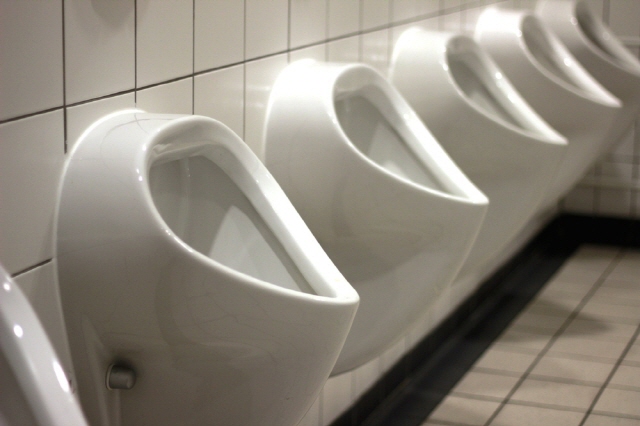
You are a GUI agent. You are given a task and a screenshot of the screen. Output one action in this format:
    pyautogui.click(x=<x>, y=<y>)
    Task: Click on the urinals
    Image resolution: width=640 pixels, height=426 pixels.
    Given the screenshot: What is the action you would take?
    pyautogui.click(x=22, y=373), pyautogui.click(x=179, y=299), pyautogui.click(x=356, y=181), pyautogui.click(x=458, y=108), pyautogui.click(x=516, y=75), pyautogui.click(x=587, y=43)